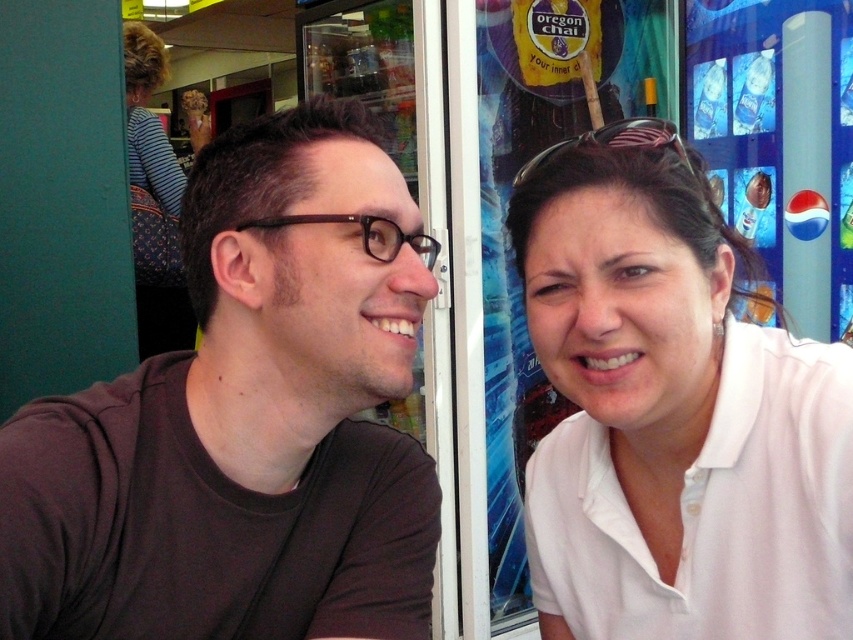
Question: Is brown matte shirt at left to the right of white smooth shirt at right from the viewer's perspective?

Choices:
 (A) no
 (B) yes

Answer: (A)

Question: Does brown matte shirt at left come in front of white smooth shirt at right?

Choices:
 (A) yes
 (B) no

Answer: (A)

Question: Does brown matte shirt at left appear over white smooth shirt at right?

Choices:
 (A) no
 (B) yes

Answer: (B)